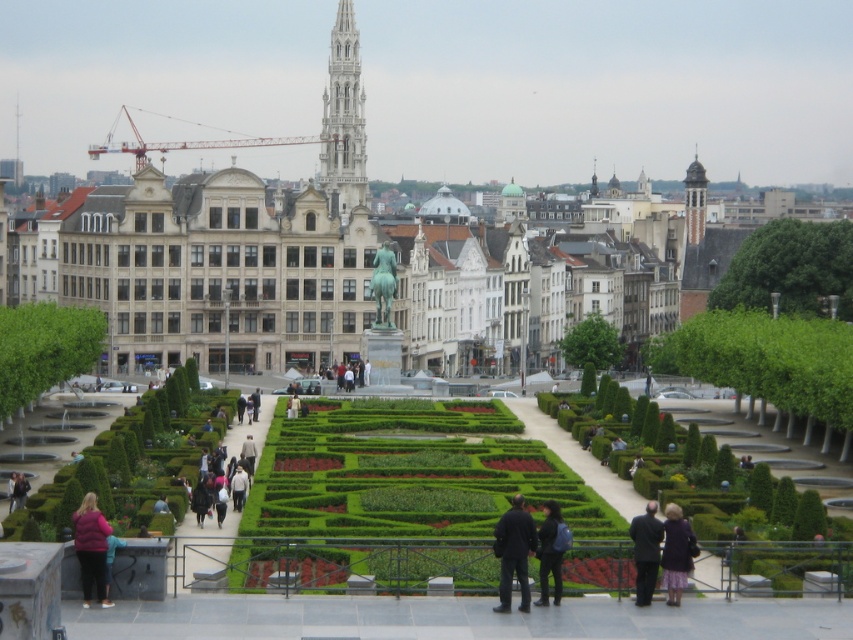
Is the position of green leafy hedge at lower left less distant than that of light beige jacket at center?

That is True.

Who is more distant from viewer, (44, 513) or (248, 454)?

The point (248, 454) is more distant.

I want to click on green leafy hedge at lower left, so click(136, 456).

Does green leafy hedge at lower left have a smaller size compared to dark gray suit at lower right?

Actually, green leafy hedge at lower left might be larger than dark gray suit at lower right.

Is green leafy hedge at lower left closer to the viewer compared to dark gray suit at lower right?

No, it is not.

Does point (160, 490) come farther from viewer compared to point (643, 554)?

Yes.

You are a GUI agent. You are given a task and a screenshot of the screen. Output one action in this format:
    pyautogui.click(x=<x>, y=<y>)
    Task: Click on the green leafy hedge at lower left
    Image resolution: width=853 pixels, height=640 pixels.
    Given the screenshot: What is the action you would take?
    pyautogui.click(x=136, y=456)

Is green leafy hedge at left behind bronze statue at center?

No, it is in front of bronze statue at center.

In the scene shown: Can you confirm if green leafy hedge at left is positioned above bronze statue at center?

No.

Is point (47, 321) less distant than point (370, 291)?

Yes.

Locate an element on the screen. green leafy hedge at left is located at coordinates (44, 348).